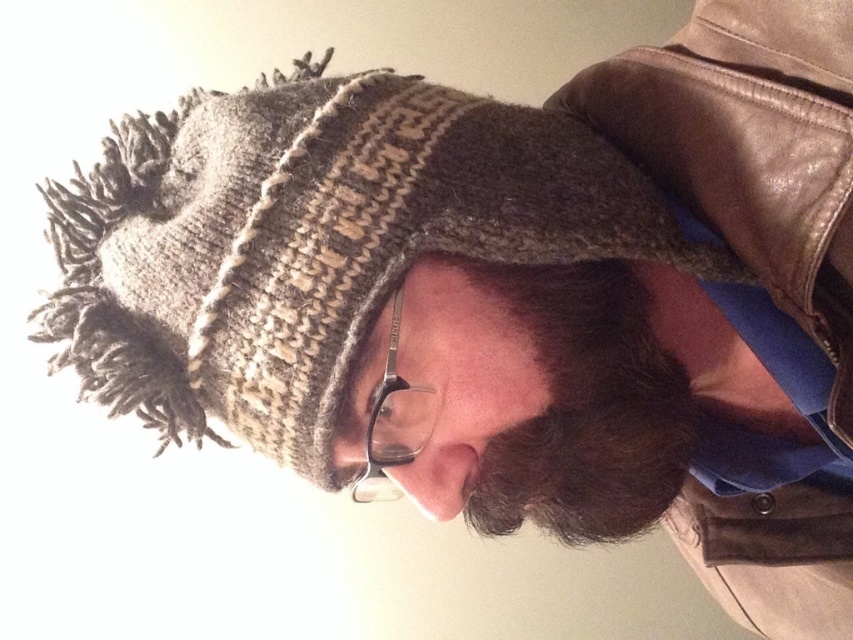
You are a photographer adjusting your camera settings to focus on the fuzzy knit hat at upper center and the dark brown fuzzy beard at center. Which object should you focus on first to ensure both are in sharp focus?

You should focus on the fuzzy knit hat at upper center first because it is closer to the viewer than the dark brown fuzzy beard at center, ensuring both will be in focus when starting from the closer object.

You are taking a photo of a person wearing a knitted hat and glasses. You notice two points in the image labeled as point [550,339] and point [624,456]. Which point is closer to the camera?

Point [550,339] is closer to the camera than point [624,456].